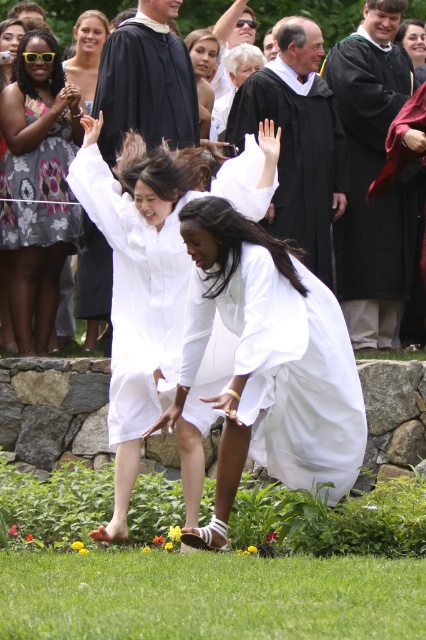
Can you confirm if white matte graduation gown at center is smaller than smooth skin face at upper center?

No, white matte graduation gown at center is not smaller than smooth skin face at upper center.

Describe the element at coordinates (135, 301) in the screenshot. I see `white matte graduation gown at center` at that location.

Which is behind, point (172, 301) or point (195, 68)?

Point (195, 68)

Locate an element on the screen. This screenshot has width=426, height=640. white matte graduation gown at center is located at coordinates (135, 301).

Can you confirm if floral-patterned fabric dress at upper left is positioned above matte black graduation gown at upper center?

Incorrect, floral-patterned fabric dress at upper left is not positioned above matte black graduation gown at upper center.

Is point (36, 170) closer to camera compared to point (135, 122)?

That is False.

Who is more forward, [43,173] or [132,115]?

Point [132,115] is in front.

The image size is (426, 640). What are the coordinates of `floral-patterned fabric dress at upper left` in the screenshot? It's located at (39, 192).

Is point (187, 316) positioned after point (417, 54)?

No, (187, 316) is in front of (417, 54).

Between white satin dress at center and matte black graduation gown at upper right, which one has more height?

matte black graduation gown at upper right

Describe the element at coordinates (268, 360) in the screenshot. I see `white satin dress at center` at that location.

Locate an element on the screen. The width and height of the screenshot is (426, 640). white satin dress at center is located at coordinates (268, 360).